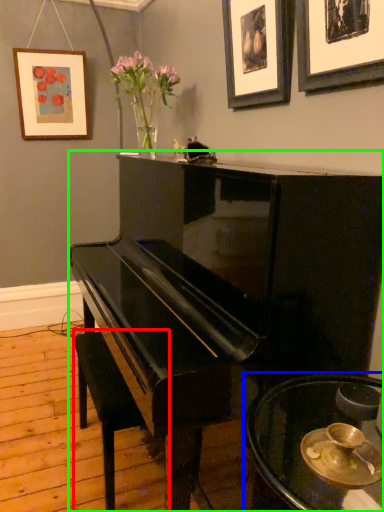
Question: Which object is positioned farthest from music stool (highlighted by a red box)? Select from table (highlighted by a blue box) and piano (highlighted by a green box).

Choices:
 (A) table
 (B) piano

Answer: (A)